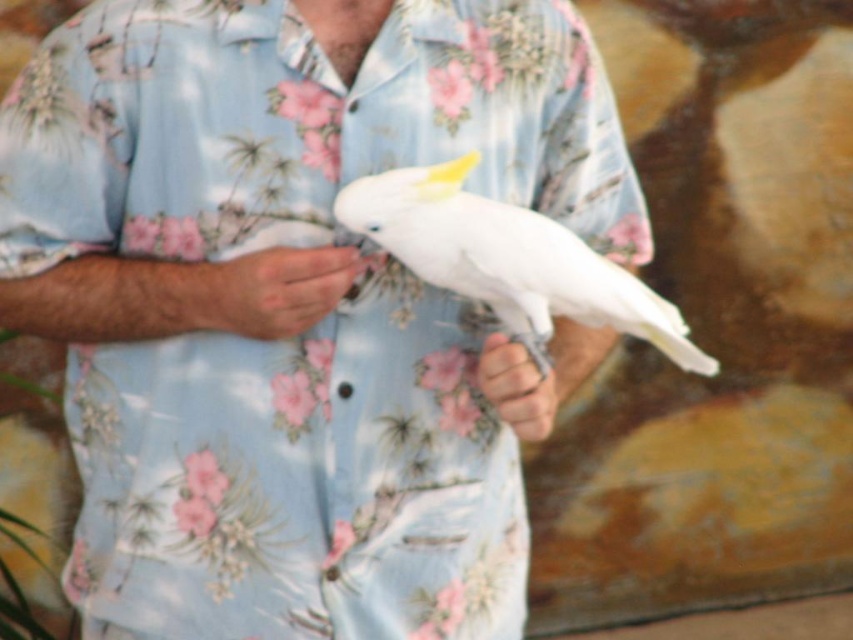
You are a photographer trying to capture the interaction between the two hands in the scene. Which hand, the white matte hand at center or the smooth skin hand at center, appears shorter in the image?

The white matte hand at center has a lesser height compared to the smooth skin hand at center, so the white matte hand at center appears shorter in the image.